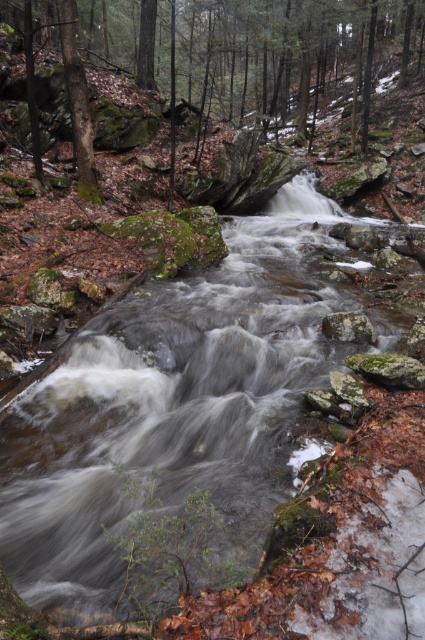
Question: Is smooth rock stream at center wider than green mossy tree at left?

Choices:
 (A) no
 (B) yes

Answer: (B)

Question: Can you confirm if green mossy rock at center is positioned to the right of green mossy tree at left?

Choices:
 (A) no
 (B) yes

Answer: (B)

Question: Which object is positioned farthest from the gray rough rock at center?

Choices:
 (A) green mossy tree at left
 (B) green mossy rock at center
 (C) smooth rock stream at center

Answer: (B)

Question: Which of the following is the farthest from the observer?

Choices:
 (A) smooth rock stream at center
 (B) green mossy tree at left

Answer: (B)

Question: Is green mossy rock at center smaller than gray rough rock at center?

Choices:
 (A) no
 (B) yes

Answer: (A)

Question: Which is nearer to the green mossy tree at left?

Choices:
 (A) green mossy rock at center
 (B) smooth rock stream at center
 (C) gray rough rock at center

Answer: (B)